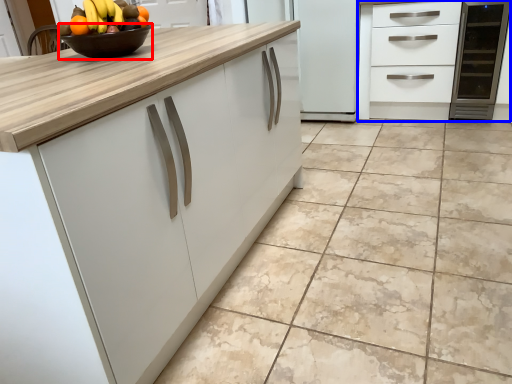
Question: Which object is further to the camera taking this photo, bowl (highlighted by a red box) or cabinetry (highlighted by a blue box)?

Choices:
 (A) bowl
 (B) cabinetry

Answer: (B)